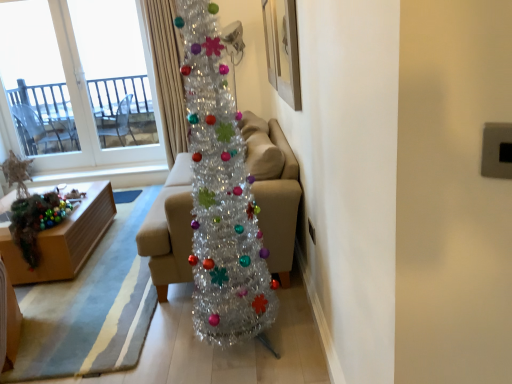
Identify the location of free space that is in between beige fabric couch at center and shiny metallic christmas tree at center. Image resolution: width=512 pixels, height=384 pixels. (192, 322).